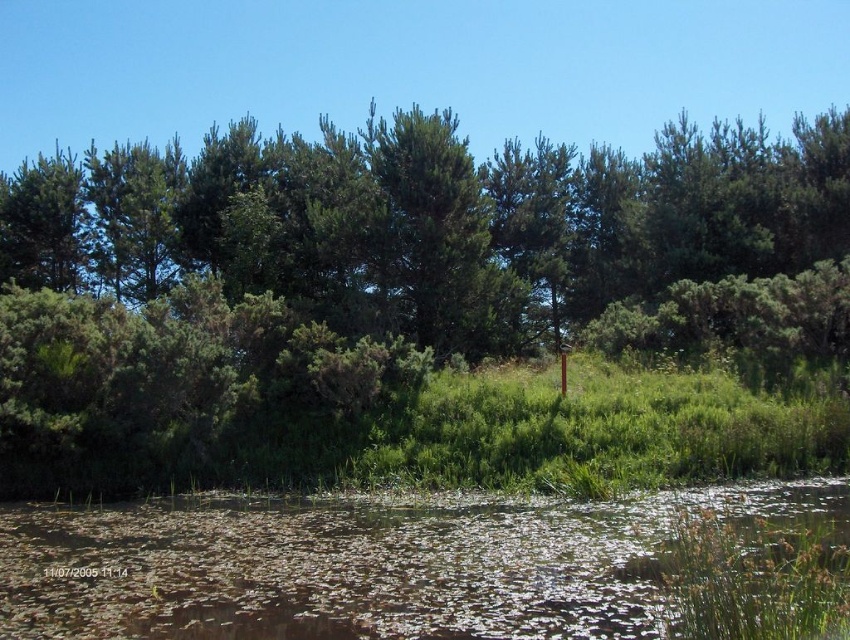
Question: Which point is closer to the camera?

Choices:
 (A) 743,282
 (B) 454,531

Answer: (B)

Question: Which point appears closest to the camera in this image?

Choices:
 (A) (248, 504)
 (B) (570, 264)

Answer: (A)

Question: Which point is closer to the camera?

Choices:
 (A) (x=299, y=212)
 (B) (x=21, y=612)

Answer: (B)

Question: Can you confirm if green leafy tree at center is positioned below translucent murky water at lower center?

Choices:
 (A) no
 (B) yes

Answer: (A)

Question: Can you confirm if green leafy tree at center is positioned to the right of translucent murky water at lower center?

Choices:
 (A) yes
 (B) no

Answer: (B)

Question: Is green leafy tree at center below translucent murky water at lower center?

Choices:
 (A) yes
 (B) no

Answer: (B)